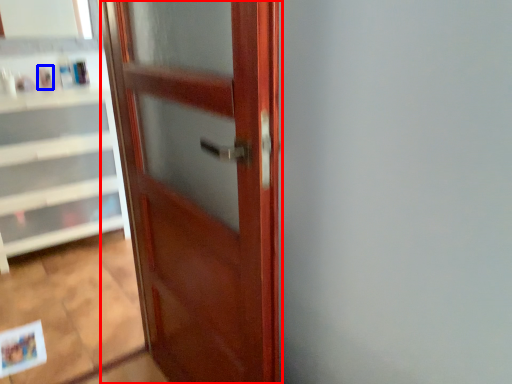
Question: Which object appears farthest to the camera in this image, door (highlighted by a red box) or toiletry (highlighted by a blue box)?

Choices:
 (A) door
 (B) toiletry

Answer: (B)